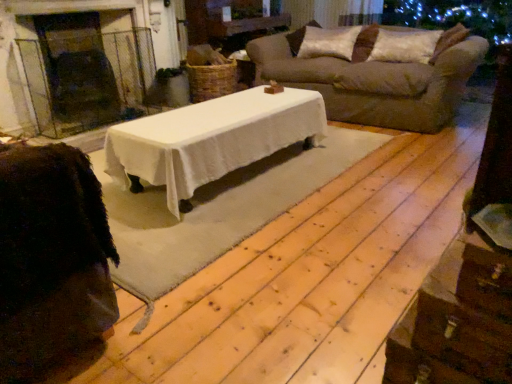
Question: Is point [23, 48] closer or farther from the camera than point [380, 51]?

Choices:
 (A) closer
 (B) farther

Answer: (A)

Question: Is glass fireplace at left taller or shorter than velvet brown pillow at upper right, which is the first pillow in right-to-left order?

Choices:
 (A) tall
 (B) short

Answer: (A)

Question: Based on their relative distances, which object is nearer to the velvet brown pillow at upper right, which is the first pillow in right-to-left order?

Choices:
 (A) silky beige pillow at upper right, the first pillow when ordered from left to right
 (B) glass fireplace at left
 (C) brown fabric sofa at upper right

Answer: (A)

Question: Which of these objects is positioned closest to the velvet brown pillow at upper right, which is the first pillow in right-to-left order?

Choices:
 (A) brown fabric sofa at upper right
 (B) silky beige pillow at upper right, which is counted as the 2th pillow, starting from the right
 (C) glass fireplace at left

Answer: (B)